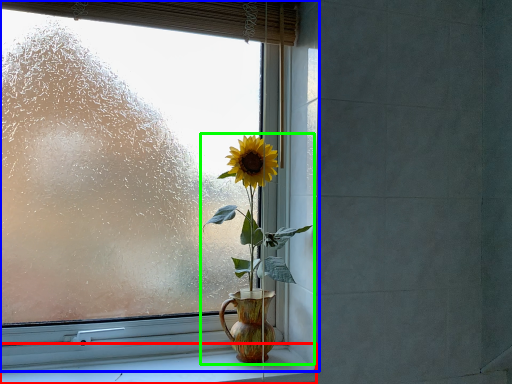
Question: Which object is positioned closest to window sill (highlighted by a red box)? Select from window (highlighted by a blue box) and houseplant (highlighted by a green box).

Choices:
 (A) window
 (B) houseplant

Answer: (B)